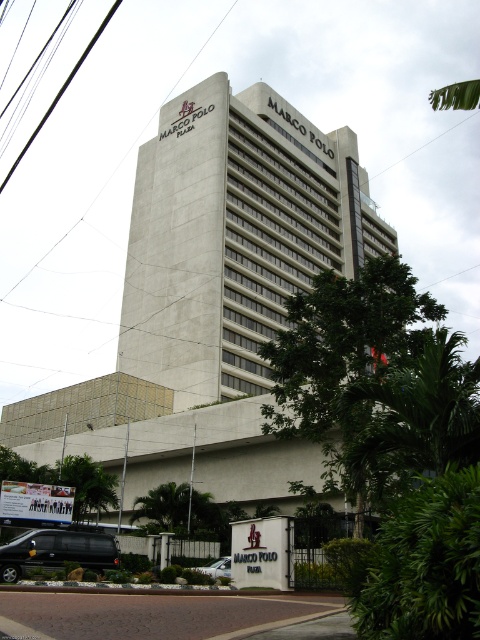
Question: Can you confirm if gray concrete building at center is wider than silver metallic car at lower center?

Choices:
 (A) no
 (B) yes

Answer: (B)

Question: Is black matte van at lower left positioned behind silver metallic car at lower center?

Choices:
 (A) yes
 (B) no

Answer: (B)

Question: Can you confirm if black matte van at lower left is positioned below silver metallic car at lower center?

Choices:
 (A) yes
 (B) no

Answer: (B)

Question: Which of the following is the closest to the observer?

Choices:
 (A) (207, 572)
 (B) (253, 244)
 (C) (71, 556)

Answer: (C)

Question: Estimate the real-world distances between objects in this image. Which object is farther from the silver metallic car at lower center?

Choices:
 (A) gray concrete building at center
 (B) black matte van at lower left

Answer: (A)

Question: Among these points, which one is nearest to the camera?

Choices:
 (A) (108, 445)
 (B) (0, 566)

Answer: (B)